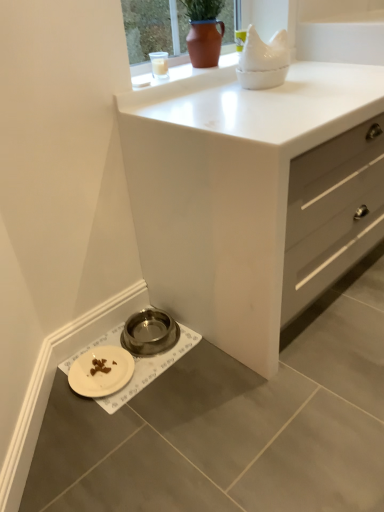
Question: From a real-world perspective, is white matte pet bowl at lower left above or below white matte chest of drawers at center?

Choices:
 (A) above
 (B) below

Answer: (B)

Question: Is point (66, 366) closer or farther from the camera than point (205, 200)?

Choices:
 (A) closer
 (B) farther

Answer: (B)

Question: Which is nearer to the white matte plate at lower left?

Choices:
 (A) white matte pet bowl at lower left
 (B) metallic bowl at lower left
 (C) white matte chest of drawers at center
 (D) matte brown pot at upper center

Answer: (A)

Question: Based on their relative distances, which object is farther from the white matte pet bowl at lower left?

Choices:
 (A) white matte chest of drawers at center
 (B) white matte plate at lower left
 (C) matte brown pot at upper center
 (D) metallic bowl at lower left

Answer: (C)